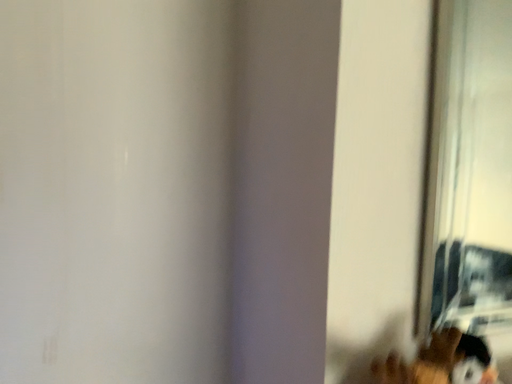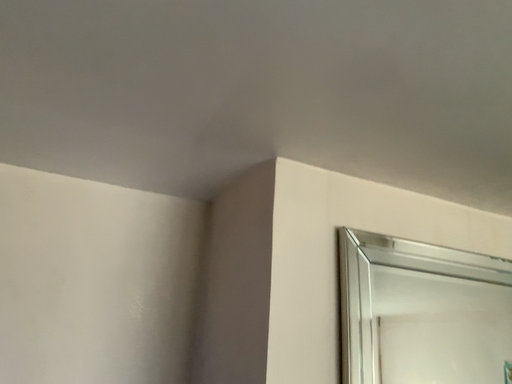
Question: Which way did the camera rotate in the video?

Choices:
 (A) rotated downward
 (B) rotated upward

Answer: (B)